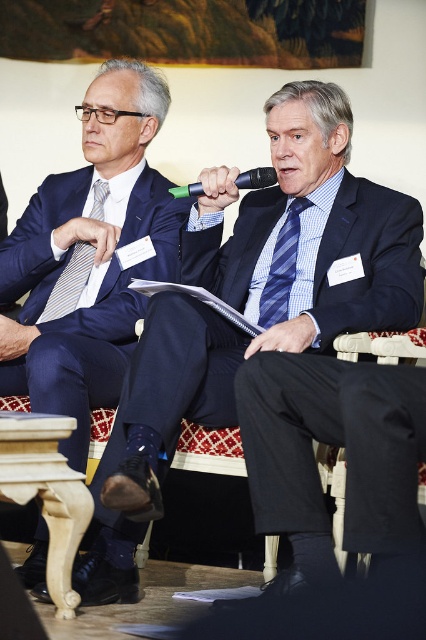
Question: Which point is farther to the camera?

Choices:
 (A) wooden chair at center
 (B) striped fabric tie at left

Answer: (B)

Question: Which point is closer to the camera taking this photo?

Choices:
 (A) (250, 188)
 (B) (293, 232)
 (C) (95, 268)
 (D) (314, 371)

Answer: (D)

Question: Does matte black suit at center have a larger size compared to matte black suit at left?

Choices:
 (A) no
 (B) yes

Answer: (B)

Question: Does matte black suit at left appear on the left side of wooden chair at center?

Choices:
 (A) no
 (B) yes

Answer: (B)

Question: Does matte black suit at left come behind green plastic microphone at center?

Choices:
 (A) yes
 (B) no

Answer: (B)

Question: Which object appears closest to the camera in this image?

Choices:
 (A) green plastic microphone at center
 (B) wooden chair at center
 (C) matte black suit at center

Answer: (B)